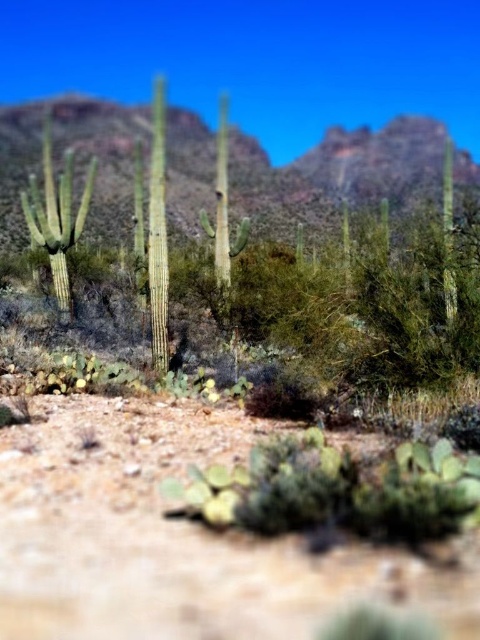
Based on the photo, you are planning to drive a small offroad vehicle along the brown sandy dirt track at lower center. Considering the space available, will the track be wide enough to allow the vehicle to pass through without touching the green textured cactus at center?

The brown sandy dirt track at lower center occupies less space than the green textured cactus at center, so the track may not be wide enough for the vehicle to pass safely without coming into contact with the cactus.